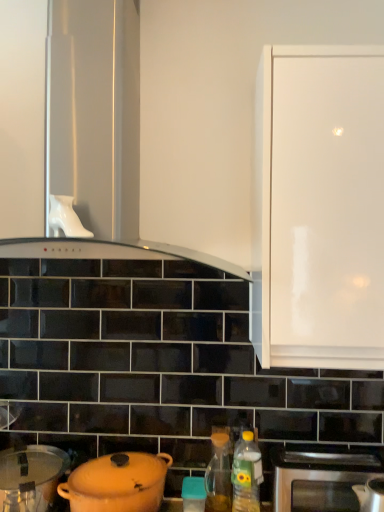
Question: Is matte orange pot at lower left, the third kitchen appliance from the right, taller than matte plastic container at center?

Choices:
 (A) no
 (B) yes

Answer: (B)

Question: From the image's perspective, is matte orange pot at lower left, the third kitchen appliance from the right, over matte plastic container at center?

Choices:
 (A) yes
 (B) no

Answer: (A)

Question: Is matte orange pot at lower left, the third kitchen appliance from the right, thinner than matte plastic container at center?

Choices:
 (A) yes
 (B) no

Answer: (B)

Question: Considering the relative sizes of matte orange pot at lower left, the first kitchen appliance in the left-to-right sequence, and matte plastic container at center in the image provided, is matte orange pot at lower left, the first kitchen appliance in the left-to-right sequence, shorter than matte plastic container at center?

Choices:
 (A) yes
 (B) no

Answer: (B)

Question: Is matte orange pot at lower left, the third kitchen appliance from the right, completely or partially outside of matte plastic container at center?

Choices:
 (A) yes
 (B) no

Answer: (A)

Question: Can we say stainless steel kettle at lower right, the 1th kitchen appliance when ordered from right to left, lies outside translucent glass oil at lower center, which appears as the 1th bottle when viewed from the left?

Choices:
 (A) no
 (B) yes

Answer: (B)

Question: Is stainless steel kettle at lower right, which ranks as the third kitchen appliance in left-to-right order, facing away from translucent glass oil at lower center, which appears as the 1th bottle when viewed from the left?

Choices:
 (A) no
 (B) yes

Answer: (A)

Question: Does stainless steel kettle at lower right, the 1th kitchen appliance when ordered from right to left, turn towards translucent glass oil at lower center, which is the first bottle from back to front?

Choices:
 (A) no
 (B) yes

Answer: (A)

Question: Is stainless steel kettle at lower right, the 1th kitchen appliance when ordered from right to left, to the right of translucent glass oil at lower center, marked as the second bottle in a right-to-left arrangement, from the viewer's perspective?

Choices:
 (A) no
 (B) yes

Answer: (B)

Question: Is stainless steel kettle at lower right, the 1th kitchen appliance when ordered from right to left, next to translucent glass oil at lower center, which appears as the 1th bottle when viewed from the left?

Choices:
 (A) yes
 (B) no

Answer: (B)

Question: Is stainless steel kettle at lower right, the 1th kitchen appliance when ordered from right to left, smaller than translucent glass oil at lower center, which is counted as the second bottle, starting from the front?

Choices:
 (A) no
 (B) yes

Answer: (A)

Question: Can you confirm if white glossy cabinet at upper right is smaller than translucent plastic bottle at lower right, which is the 2th bottle in left-to-right order?

Choices:
 (A) no
 (B) yes

Answer: (A)